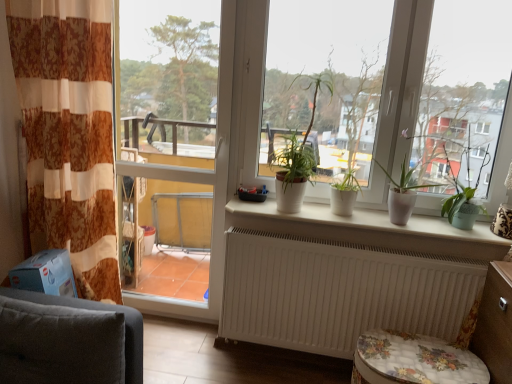
Identify the location of free spot above white ceramic plant pots at center (from a real-world perspective). The height and width of the screenshot is (384, 512). (382, 217).